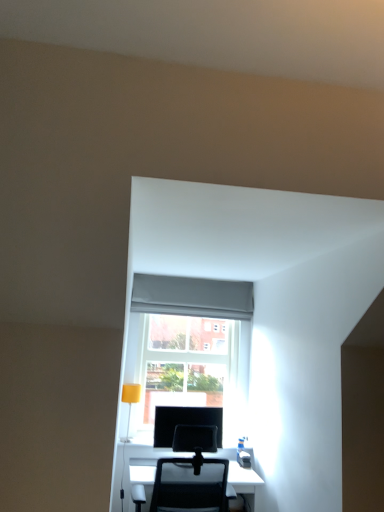
Where is `black mesh chair at lower center`? This screenshot has width=384, height=512. black mesh chair at lower center is located at coordinates (141, 481).

Identify the location of yellow matte table lamp at lower left. 130,401.

Where is `black mesh chair at lower center`? The width and height of the screenshot is (384, 512). black mesh chair at lower center is located at coordinates (141, 481).

Considering the sizes of objects black mesh chair at lower center and matte black monitor at center in the image provided, who is bigger, black mesh chair at lower center or matte black monitor at center?

black mesh chair at lower center is bigger.

Is black mesh chair at lower center looking in the opposite direction of matte black monitor at center?

That's not correct — black mesh chair at lower center is not looking away from matte black monitor at center.

Is matte black monitor at center a part of black mesh chair at lower center?

No, matte black monitor at center is located outside of black mesh chair at lower center.

From the image's perspective, which one is positioned higher, black mesh chair at lower center or matte black monitor at center?

matte black monitor at center appears higher in the image.

At what (x,y) coordinates should I click in order to perform the action: click on computer monitor below the yellow matte table lamp at lower left (from a real-world perspective). Please return your answer as a coordinate pair (x, y). This screenshot has width=384, height=512. Looking at the image, I should click on (184, 422).

From the image's perspective, is yellow matte table lamp at lower left positioned above or below matte black monitor at center?

yellow matte table lamp at lower left is above matte black monitor at center.

Is yellow matte table lamp at lower left far from matte black monitor at center?

No, there isn't a large distance between yellow matte table lamp at lower left and matte black monitor at center.

Considering the positions of objects yellow matte table lamp at lower left and matte black monitor at center in the image provided, who is more to the right, yellow matte table lamp at lower left or matte black monitor at center?

matte black monitor at center.

Measure the distance between transparent glass door at center and black mesh chair at lower center.

A distance of 3.34 feet exists between transparent glass door at center and black mesh chair at lower center.

Is transparent glass door at center facing away from black mesh chair at lower center?

That's not correct — transparent glass door at center is not looking away from black mesh chair at lower center.

From the image's perspective, which is below, transparent glass door at center or black mesh chair at lower center?

From the image's view, black mesh chair at lower center is below.

Is transparent glass door at center situated inside black mesh chair at lower center or outside?

transparent glass door at center is spatially situated outside black mesh chair at lower center.

Is black mesh chair at lower center not near transparent glass door at center?

Yes, black mesh chair at lower center and transparent glass door at center are located far from each other.

Does black mesh chair at lower center appear on the left side of transparent glass door at center?

Incorrect, black mesh chair at lower center is not on the left side of transparent glass door at center.

Could you tell me if black mesh chair at lower center is turned towards transparent glass door at center?

No.

Between transparent glass door at center and matte black monitor at center, which one has smaller size?

With smaller size is matte black monitor at center.

The width and height of the screenshot is (384, 512). I want to click on glass door above the matte black monitor at center (from the image's perspective), so click(x=184, y=364).

Is transparent glass door at center turned away from matte black monitor at center?

No, matte black monitor at center is not at the back of transparent glass door at center.

From a real-world perspective, is transparent glass door at center physically located above or below matte black monitor at center?

transparent glass door at center is situated higher than matte black monitor at center in the real world.

Find the location of a particular element. Image resolution: width=384 pixels, height=512 pixels. glass door behind the yellow matte table lamp at lower left is located at coordinates (184, 364).

From a real-world perspective, is yellow matte table lamp at lower left over transparent glass door at center?

No.

What's the angular difference between yellow matte table lamp at lower left and transparent glass door at center's facing directions?

The facing directions of yellow matte table lamp at lower left and transparent glass door at center are 1.86 degrees apart.

Consider the image. Considering the positions of objects yellow matte table lamp at lower left and transparent glass door at center in the image provided, who is more to the right, yellow matte table lamp at lower left or transparent glass door at center?

From the viewer's perspective, transparent glass door at center appears more on the right side.

Would you say yellow matte table lamp at lower left is outside black mesh chair at lower center?

Yes.

From the image's perspective, between yellow matte table lamp at lower left and black mesh chair at lower center, who is located below?

black mesh chair at lower center appears lower in the image.

Which of these two, yellow matte table lamp at lower left or black mesh chair at lower center, stands shorter?

With less height is yellow matte table lamp at lower left.

The image size is (384, 512). I want to click on chair located underneath the matte black monitor at center (from a real-world perspective), so click(141, 481).

Where is `table lamp above the matte black monitor at center (from a real-world perspective)`? table lamp above the matte black monitor at center (from a real-world perspective) is located at coordinates (130, 401).

Looking at the image, which one is located closer to matte black monitor at center, transparent glass door at center or black mesh chair at lower center?

Based on the image, black mesh chair at lower center appears to be nearer to matte black monitor at center.

Based on their spatial positions, is yellow matte table lamp at lower left or transparent glass door at center further from black mesh chair at lower center?

transparent glass door at center lies further to black mesh chair at lower center than the other object.

Which object lies nearer to the anchor point transparent glass door at center, yellow matte table lamp at lower left or black mesh chair at lower center?

Based on the image, yellow matte table lamp at lower left appears to be nearer to transparent glass door at center.

Estimate the real-world distances between objects in this image. Which object is further from transparent glass door at center, yellow matte table lamp at lower left or matte black monitor at center?

The object further to transparent glass door at center is yellow matte table lamp at lower left.

Estimate the real-world distances between objects in this image. Which object is closer to transparent glass door at center, matte black monitor at center or black mesh chair at lower center?

matte black monitor at center lies closer to transparent glass door at center than the other object.

From the image, which object appears to be farther from yellow matte table lamp at lower left, matte black monitor at center or transparent glass door at center?

Based on the image, transparent glass door at center appears to be further to yellow matte table lamp at lower left.

Based on their spatial positions, is black mesh chair at lower center or matte black monitor at center closer to yellow matte table lamp at lower left?

matte black monitor at center lies closer to yellow matte table lamp at lower left than the other object.

Based on their spatial positions, is yellow matte table lamp at lower left or black mesh chair at lower center closer to matte black monitor at center?

Based on the image, yellow matte table lamp at lower left appears to be nearer to matte black monitor at center.

Where is `computer monitor between black mesh chair at lower center and yellow matte table lamp at lower left in the front-back direction`? The width and height of the screenshot is (384, 512). computer monitor between black mesh chair at lower center and yellow matte table lamp at lower left in the front-back direction is located at coordinates (184, 422).

You are a GUI agent. You are given a task and a screenshot of the screen. Output one action in this format:
    pyautogui.click(x=<x>, y=<y>)
    Task: Click on the glass door situated between yellow matte table lamp at lower left and matte black monitor at center from left to right
    
    Given the screenshot: What is the action you would take?
    pyautogui.click(x=184, y=364)

Where is `table lamp between black mesh chair at lower center and transparent glass door at center along the z-axis`? The image size is (384, 512). table lamp between black mesh chair at lower center and transparent glass door at center along the z-axis is located at coordinates (130, 401).

You are a GUI agent. You are given a task and a screenshot of the screen. Output one action in this format:
    pyautogui.click(x=<x>, y=<y>)
    Task: Click on the computer monitor between black mesh chair at lower center and transparent glass door at center from front to back
    
    Given the screenshot: What is the action you would take?
    pyautogui.click(x=184, y=422)